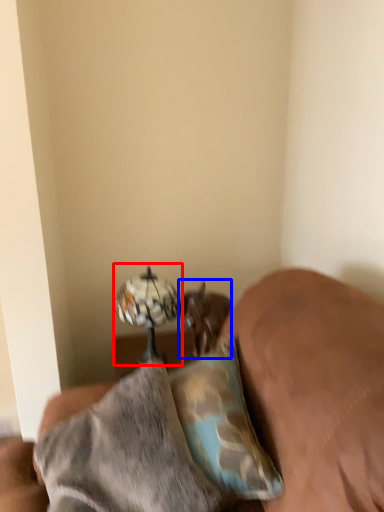
Question: Which point is further to the camera, table lamp (highlighted by a red box) or animal (highlighted by a blue box)?

Choices:
 (A) table lamp
 (B) animal

Answer: (B)